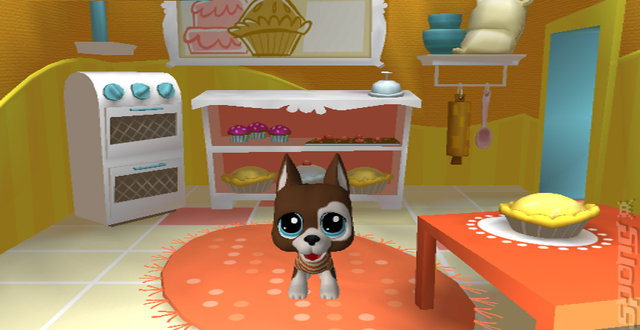
At what (x,y) coordinates should I click in order to perform the action: click on rolling pin. Please return your answer as a coordinate pair (x, y). Looking at the image, I should click on (461, 128).